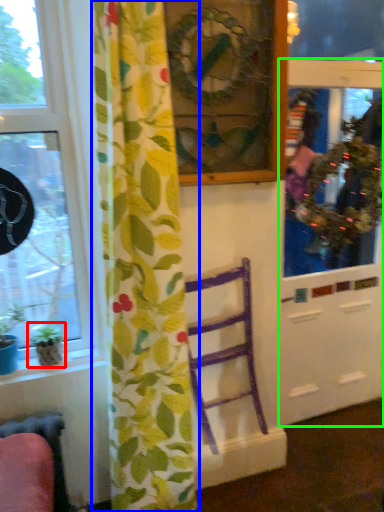
Question: Which object is the closest to the houseplant (highlighted by a red box)? Choose among these: curtain (highlighted by a blue box) or screen door (highlighted by a green box).

Choices:
 (A) curtain
 (B) screen door

Answer: (A)